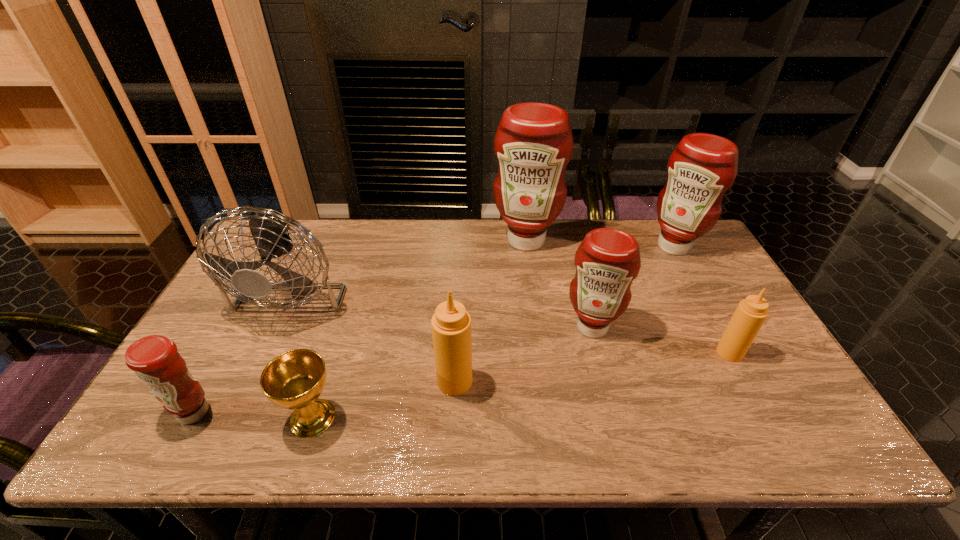
The image size is (960, 540). Identify the location of free point between the second nearest red condiment and the nearest red condiment. (393, 370).

The height and width of the screenshot is (540, 960). I want to click on object that is the fourth closest to the nearest red condiment, so click(533, 144).

The height and width of the screenshot is (540, 960). I want to click on object identified as the closest to the gold chalice, so click(155, 360).

Where is `the closest condiment to the shortest object`? the closest condiment to the shortest object is located at coordinates (155, 360).

Select which condiment is the fifth closest to the leftmost red condiment. Please provide its 2D coordinates. Your answer should be formatted as a tuple, i.e. [(x, y)], where the tuple contains the x and y coordinates of a point satisfying the conditions above.

[(701, 169)]

Choose which red condiment is the second nearest neighbor to the gold chalice. Please provide its 2D coordinates. Your answer should be formatted as a tuple, i.e. [(x, y)], where the tuple contains the x and y coordinates of a point satisfying the conditions above.

[(607, 261)]

Choose which red condiment is the third nearest neighbor to the leftmost condiment. Please provide its 2D coordinates. Your answer should be formatted as a tuple, i.e. [(x, y)], where the tuple contains the x and y coordinates of a point satisfying the conditions above.

[(701, 169)]

This screenshot has width=960, height=540. What are the coordinates of `vacant space that satisfies the following two spatial constraints: 1. on the back side of the gold chalice; 2. on the right side of the right tan condiment` in the screenshot? It's located at (333, 353).

What are the coordinates of `vacant space that satisfies the following two spatial constraints: 1. on the front-facing side of the farther tan condiment; 2. on the right side of the fan` in the screenshot? It's located at pyautogui.click(x=267, y=353).